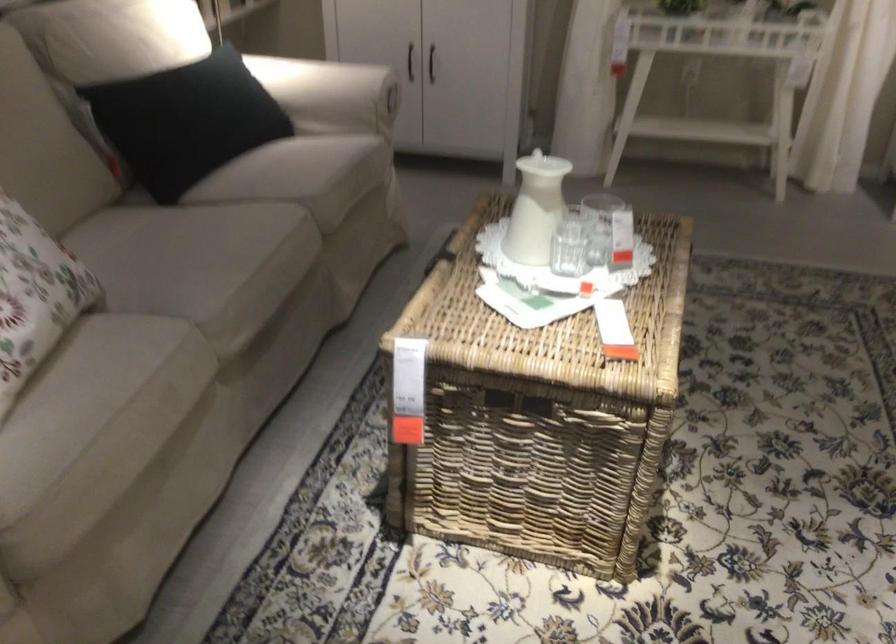
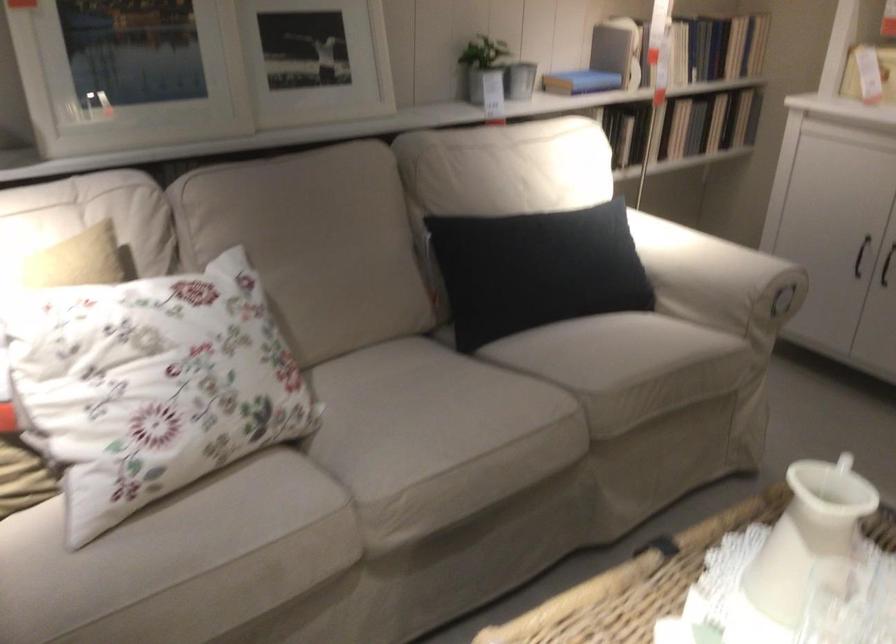
The point at [428,69] is marked in the first image. Where is the corresponding point in the second image?

(886, 265)